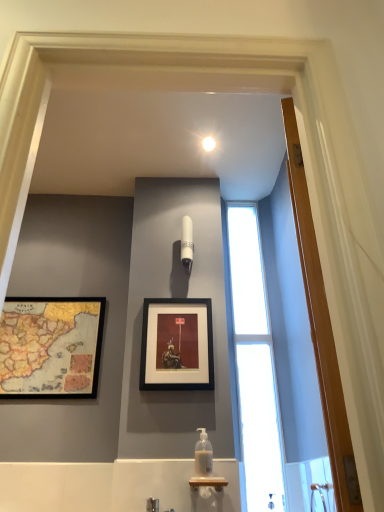
Question: Is wooden framed map at left, the first picture frame from the left, smaller than translucent plastic soap dispenser at center?

Choices:
 (A) yes
 (B) no

Answer: (B)

Question: Is wooden framed map at left, arranged as the 2th picture frame when viewed from the right, at the left side of translucent plastic soap dispenser at center?

Choices:
 (A) no
 (B) yes

Answer: (B)

Question: From the image's perspective, is wooden framed map at left, the first picture frame from the left, located beneath translucent plastic soap dispenser at center?

Choices:
 (A) no
 (B) yes

Answer: (A)

Question: Does wooden framed map at left, the first picture frame from the left, have a lesser height compared to translucent plastic soap dispenser at center?

Choices:
 (A) no
 (B) yes

Answer: (A)

Question: Is the depth of wooden framed map at left, arranged as the 2th picture frame when viewed from the right, greater than that of translucent plastic soap dispenser at center?

Choices:
 (A) yes
 (B) no

Answer: (A)

Question: From the image's perspective, is white glossy light fixture at upper center located above or below wooden framed map at left, arranged as the 2th picture frame when viewed from the right?

Choices:
 (A) below
 (B) above

Answer: (B)

Question: In terms of size, does white glossy light fixture at upper center appear bigger or smaller than wooden framed map at left, arranged as the 2th picture frame when viewed from the right?

Choices:
 (A) big
 (B) small

Answer: (B)

Question: Based on their positions, is white glossy light fixture at upper center located to the left or right of wooden framed map at left, arranged as the 2th picture frame when viewed from the right?

Choices:
 (A) left
 (B) right

Answer: (B)

Question: From their relative heights in the image, would you say white glossy light fixture at upper center is taller or shorter than wooden framed map at left, arranged as the 2th picture frame when viewed from the right?

Choices:
 (A) short
 (B) tall

Answer: (A)

Question: In the image, is white glossy light fixture at upper center on the left side or the right side of translucent plastic soap dispenser at center?

Choices:
 (A) left
 (B) right

Answer: (A)

Question: Is white glossy light fixture at upper center in front of or behind translucent plastic soap dispenser at center in the image?

Choices:
 (A) front
 (B) behind

Answer: (B)

Question: In terms of width, does white glossy light fixture at upper center look wider or thinner when compared to translucent plastic soap dispenser at center?

Choices:
 (A) wide
 (B) thin

Answer: (B)

Question: Considering the positions of white glossy light fixture at upper center and translucent plastic soap dispenser at center in the image, is white glossy light fixture at upper center taller or shorter than translucent plastic soap dispenser at center?

Choices:
 (A) short
 (B) tall

Answer: (B)

Question: From the image's perspective, is wooden door at right above or below black matte picture frame at center, the 2th picture frame when ordered from left to right?

Choices:
 (A) below
 (B) above

Answer: (B)

Question: Is wooden door at right in front of or behind black matte picture frame at center, which is counted as the first picture frame, starting from the right, in the image?

Choices:
 (A) front
 (B) behind

Answer: (A)